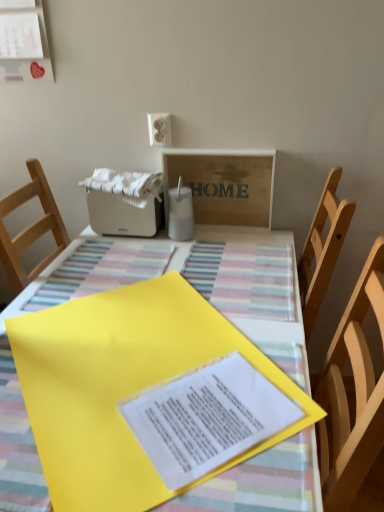
The height and width of the screenshot is (512, 384). Describe the element at coordinates (24, 42) in the screenshot. I see `matte white paper at upper left` at that location.

Measure the distance between point [205,390] and camera.

34.17 inches.

Find the location of a particular element. The image size is (384, 512). white plastic toaster at upper center is located at coordinates (124, 202).

Find the location of a particular element. This screenshot has width=384, height=512. bulletin board that is in front of the wooden signboard at upper center is located at coordinates (24, 42).

From a real-world perspective, is wooden signboard at upper center under matte white paper at upper left?

Yes, from a real-world perspective, wooden signboard at upper center is under matte white paper at upper left.

Visually, is wooden signboard at upper center positioned to the left or to the right of matte white paper at upper left?

wooden signboard at upper center is positioned on matte white paper at upper left's right side.

Which object is wider, wooden signboard at upper center or matte white paper at upper left?

wooden signboard at upper center is wider.

Would you say yellow paper at center is outside white plastic toaster at upper center?

yellow paper at center lies outside white plastic toaster at upper center's area.

From a real-world perspective, between yellow paper at center and white plastic toaster at upper center, who is vertically higher?

white plastic toaster at upper center is physically above.

Between yellow paper at center and white plastic toaster at upper center, which one has smaller size?

With smaller size is yellow paper at center.

Does yellow paper at center turn towards white plastic toaster at upper center?

No, yellow paper at center does not turn towards white plastic toaster at upper center.

Is white plastic toaster at upper center to the left or to the right of wooden signboard at upper center in the image?

In the image, white plastic toaster at upper center appears on the left side of wooden signboard at upper center.

Does white plastic toaster at upper center have a smaller size compared to wooden signboard at upper center?

No.

Which object is wider, white plastic toaster at upper center or wooden signboard at upper center?

white plastic toaster at upper center is wider.

Relative to wooden signboard at upper center, is white plastic toaster at upper center in front or behind?

white plastic toaster at upper center is positioned farther from the viewer than wooden signboard at upper center.

Based on the photo, from a real-world perspective, who is located lower, matte white paper at upper left or wooden signboard at upper center?

In real-world perspective, wooden signboard at upper center is lower.

Based on the photo, is matte white paper at upper left outside of wooden signboard at upper center?

matte white paper at upper left lies outside wooden signboard at upper center's area.

This screenshot has height=512, width=384. I want to click on bulletin board on the left of wooden signboard at upper center, so click(24, 42).

Considering the positions of objects matte white paper at upper left and wooden signboard at upper center in the image provided, who is behind, matte white paper at upper left or wooden signboard at upper center?

wooden signboard at upper center.

Does point (140, 173) come behind point (183, 437)?

Yes, point (140, 173) is behind point (183, 437).

Is white plastic toaster at upper center not within yellow paper at center?

Indeed, white plastic toaster at upper center is completely outside yellow paper at center.

From the image's perspective, is white plastic toaster at upper center located above or below yellow paper at center?

Clearly, from the image's perspective, white plastic toaster at upper center is above yellow paper at center.

Looking at the image, does white plastic toaster at upper center seem bigger or smaller compared to yellow paper at center?

white plastic toaster at upper center is bigger than yellow paper at center.

Where is `appliance above the yellow paper at center (from a real-world perspective)`? The width and height of the screenshot is (384, 512). appliance above the yellow paper at center (from a real-world perspective) is located at coordinates (124, 202).

Considering the relative positions of yellow paper at center and white plastic toaster at upper center in the image provided, is yellow paper at center behind white plastic toaster at upper center?

No, it is in front of white plastic toaster at upper center.

Is yellow paper at center far from white plastic toaster at upper center?

That's not correct — yellow paper at center is a little close to white plastic toaster at upper center.

From a real-world perspective, does matte white paper at upper left sit lower than yellow paper at center?

No, from a real-world perspective, matte white paper at upper left is not beneath yellow paper at center.

The image size is (384, 512). I want to click on table that is under the matte white paper at upper left (from a real-world perspective), so click(x=193, y=282).

Can you confirm if matte white paper at upper left is positioned to the left of yellow paper at center?

Indeed, matte white paper at upper left is positioned on the left side of yellow paper at center.

Is matte white paper at upper left spatially inside yellow paper at center, or outside of it?

matte white paper at upper left is not enclosed by yellow paper at center.

In the image, there is a wooden signboard at upper center. Where is `bulletin board above it (from the image's perspective)`? bulletin board above it (from the image's perspective) is located at coordinates (24, 42).

Image resolution: width=384 pixels, height=512 pixels. Identify the location of appliance behind the yellow paper at center. (124, 202).

Which object lies nearer to the anchor point yellow paper at center, wooden signboard at upper center or white plastic toaster at upper center?

white plastic toaster at upper center is positioned closer to the anchor yellow paper at center.

Estimate the real-world distances between objects in this image. Which object is further from matte white paper at upper left, white plastic toaster at upper center or yellow paper at center?

yellow paper at center.

Consider the image. Estimate the real-world distances between objects in this image. Which object is further from matte white paper at upper left, white plastic toaster at upper center or wooden signboard at upper center?

The object further to matte white paper at upper left is wooden signboard at upper center.

Looking at the image, which one is located further to yellow paper at center, yellow paper at center or white plastic toaster at upper center?

white plastic toaster at upper center is further to yellow paper at center.

Which object lies nearer to the anchor point wooden signboard at upper center, matte white paper at upper left or white plastic toaster at upper center?

white plastic toaster at upper center lies closer to wooden signboard at upper center than the other object.

When comparing their distances from matte white paper at upper left, does yellow paper at center or wooden signboard at upper center seem further?

Among the two, yellow paper at center is located further to matte white paper at upper left.

Considering their positions, is yellow paper at center positioned further to yellow paper at center than white plastic toaster at upper center?

white plastic toaster at upper center is positioned further to the anchor yellow paper at center.

When comparing their distances from wooden signboard at upper center, does yellow paper at center or yellow paper at center seem closer?

The object closer to wooden signboard at upper center is yellow paper at center.

Find the location of a particular element. cardboard box between yellow paper at center and white plastic toaster at upper center from front to back is located at coordinates (224, 185).

Where is `cardboard box that lies between matte white paper at upper left and yellow paper at center from top to bottom`? This screenshot has width=384, height=512. cardboard box that lies between matte white paper at upper left and yellow paper at center from top to bottom is located at coordinates (224, 185).

You are a GUI agent. You are given a task and a screenshot of the screen. Output one action in this format:
    pyautogui.click(x=<x>, y=<y>)
    Task: Click on the appliance between matte white paper at upper left and yellow paper at center in the vertical direction
    The height and width of the screenshot is (512, 384).
    Given the screenshot: What is the action you would take?
    pyautogui.click(x=124, y=202)

Locate an element on the screen. journal between yellow paper at center and wooden signboard at upper center from front to back is located at coordinates (206, 418).